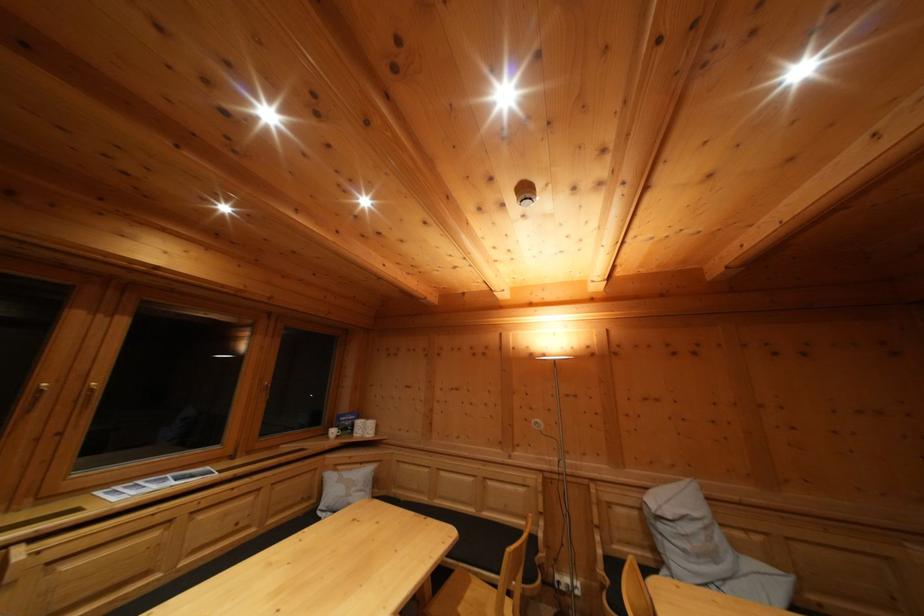
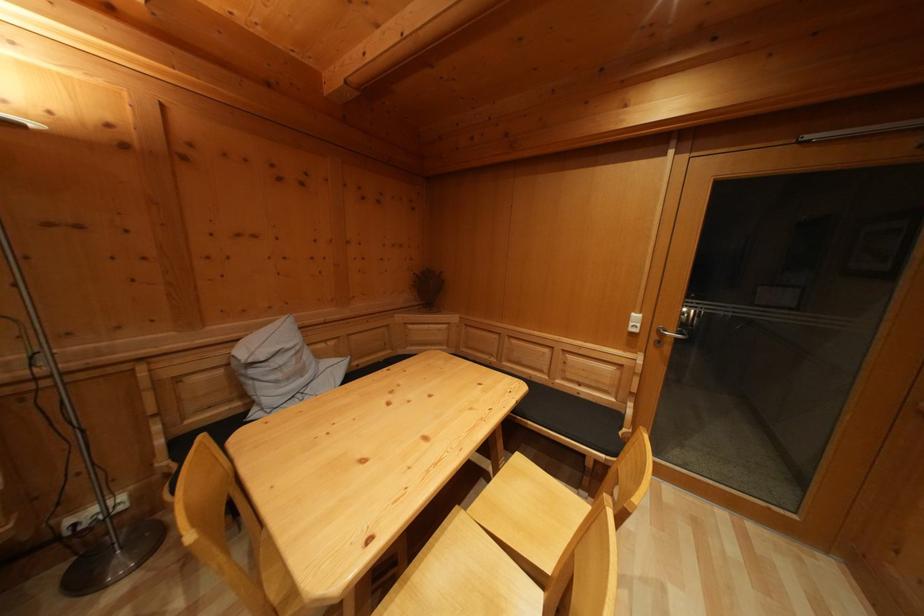
The images are taken continuously from a first-person perspective. In which direction is your viewpoint rotating?

The rotation direction of the camera is right-down.